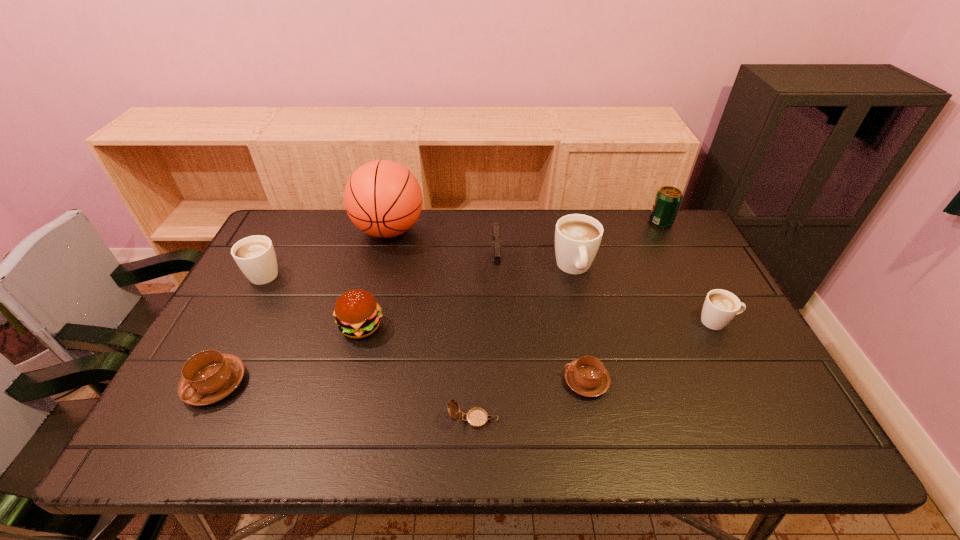
Where is `vacant space in between the orange basketball and the left brown cappuccino`? The image size is (960, 540). vacant space in between the orange basketball and the left brown cappuccino is located at coordinates (302, 307).

The image size is (960, 540). Identify the location of blank region between the right brown cappuccino and the green beer can. (624, 301).

Find the location of a particular element. This screenshot has width=960, height=540. free space between the tallest cappuccino and the left brown cappuccino is located at coordinates (395, 326).

Locate an element on the screen. vacant region between the compass and the second smallest white cappuccino is located at coordinates [370, 346].

Locate an element on the screen. empty space between the bigger brown cappuccino and the hamburger is located at coordinates (288, 355).

Identify the location of empty space between the compass and the right brown cappuccino. (530, 400).

You are a GUI agent. You are given a task and a screenshot of the screen. Output one action in this format:
    pyautogui.click(x=<x>, y=<y>)
    Task: Click on the vacant space in between the green beer can and the brown hamburger
    The height and width of the screenshot is (540, 960).
    Given the screenshot: What is the action you would take?
    click(511, 274)

Where is `empty location between the basketball and the leftmost white cappuccino`? The height and width of the screenshot is (540, 960). empty location between the basketball and the leftmost white cappuccino is located at coordinates (327, 251).

At what (x,y) coordinates should I click in order to perform the action: click on free spot between the brown hamburger and the tallest object. Please return your answer as a coordinate pair (x, y). This screenshot has height=540, width=960. Looking at the image, I should click on (375, 278).

You are a GUI agent. You are given a task and a screenshot of the screen. Output one action in this format:
    pyautogui.click(x=<x>, y=<y>)
    Task: Click on the object identified as the fifth closest to the leftmost white cappuccino
    Image resolution: width=960 pixels, height=540 pixels.
    Given the screenshot: What is the action you would take?
    click(x=477, y=418)